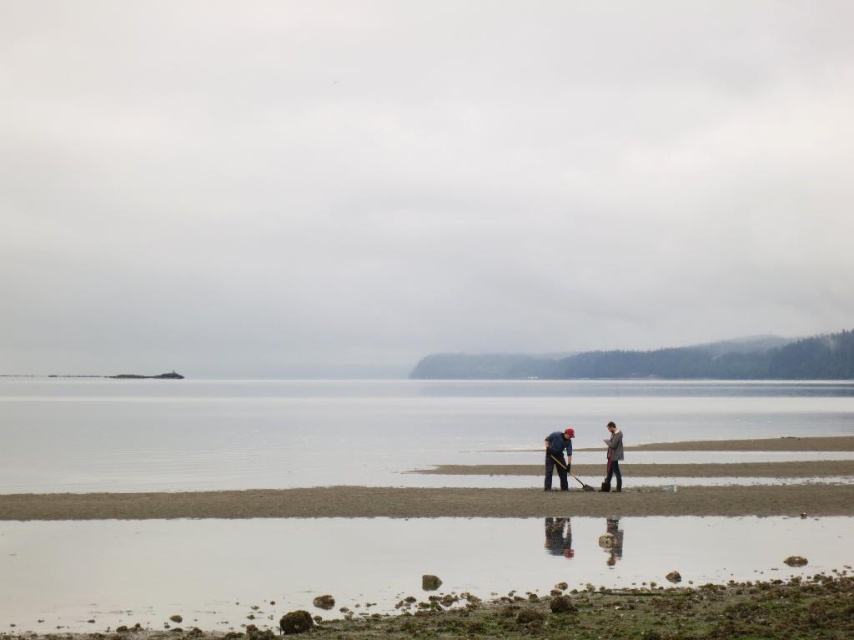
You are a photographer planning to capture the blue fabric jacket at center and the clear water at center in a single frame. Since both are at the center, will you need to adjust your camera angle to include both?

The clear water at center is positioned under the blue fabric jacket at center, so you can capture both in the same frame without needing to adjust the camera angle since they are vertically aligned.

You are a hiker who has just arrived at the beach and notices the clear water at center and the gray wool sweater at center. Which object is bigger?

The clear water at center is larger in size than the gray wool sweater at center.

Looking at this image, you are a hiker who has just arrived at the beach and see the clear water at center and the gray wool sweater at center. Which object is closer to you?

The clear water at center is closer to you because the gray wool sweater at center is behind it.